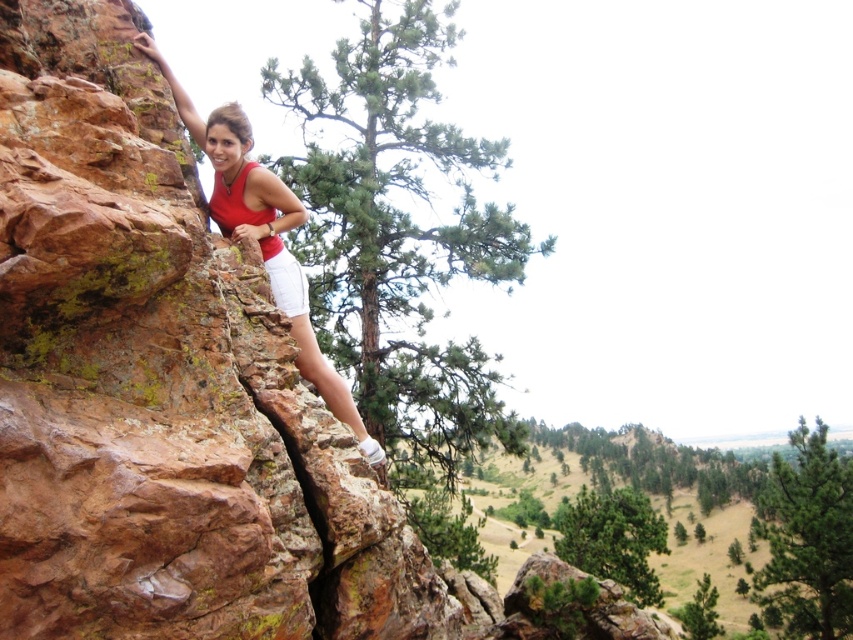
Is green matte pine at upper center thinner than white cotton shorts at center?

In fact, green matte pine at upper center might be wider than white cotton shorts at center.

Which of these two, green matte pine at upper center or white cotton shorts at center, stands taller?

With more height is green matte pine at upper center.

The width and height of the screenshot is (853, 640). I want to click on green matte pine at upper center, so click(x=807, y=540).

Between matte red tank top at center and white cotton shorts at center, which one appears on the left side from the viewer's perspective?

Positioned to the left is matte red tank top at center.

Identify the location of matte red tank top at center. (233, 168).

Based on the photo, who is more forward, (824, 620) or (206, 141)?

Point (206, 141) is in front.

Locate an element on the screen. This screenshot has width=853, height=640. green matte pine at upper center is located at coordinates (807, 540).

Is point (821, 460) closer to viewer compared to point (282, 221)?

No, (821, 460) is further to viewer.

The image size is (853, 640). I want to click on green matte pine at upper center, so click(x=807, y=540).